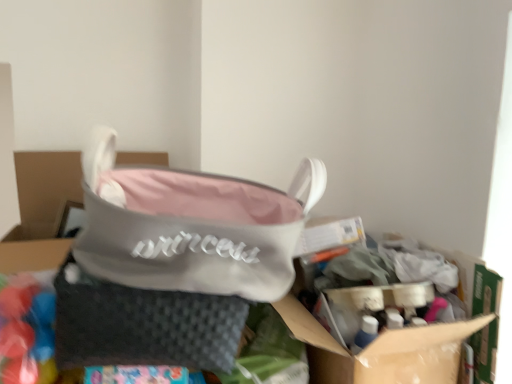
Question: Considering the relative sizes of cardboard box at center and pink fabric handbag at center in the image provided, is cardboard box at center thinner than pink fabric handbag at center?

Choices:
 (A) no
 (B) yes

Answer: (A)

Question: Does cardboard box at center have a smaller size compared to pink fabric handbag at center?

Choices:
 (A) yes
 (B) no

Answer: (B)

Question: From the image's perspective, is cardboard box at center over pink fabric handbag at center?

Choices:
 (A) no
 (B) yes

Answer: (A)

Question: Is cardboard box at center not close to pink fabric handbag at center?

Choices:
 (A) yes
 (B) no

Answer: (B)

Question: Is cardboard box at center facing away from pink fabric handbag at center?

Choices:
 (A) no
 (B) yes

Answer: (A)

Question: Considering the relative sizes of cardboard box at center and pink fabric handbag at center in the image provided, is cardboard box at center bigger than pink fabric handbag at center?

Choices:
 (A) no
 (B) yes

Answer: (B)

Question: Does cardboard box at center lie behind gray woven pouch at center?

Choices:
 (A) yes
 (B) no

Answer: (A)

Question: Are cardboard box at center and gray woven pouch at center located far from each other?

Choices:
 (A) yes
 (B) no

Answer: (B)

Question: Is cardboard box at center at the right side of gray woven pouch at center?

Choices:
 (A) no
 (B) yes

Answer: (B)

Question: From the image's perspective, would you say cardboard box at center is positioned over gray woven pouch at center?

Choices:
 (A) no
 (B) yes

Answer: (A)

Question: Is cardboard box at center positioned beyond the bounds of gray woven pouch at center?

Choices:
 (A) yes
 (B) no

Answer: (A)

Question: Can you confirm if cardboard box at center is positioned to the left of gray woven pouch at center?

Choices:
 (A) no
 (B) yes

Answer: (A)

Question: Is pink fabric handbag at center oriented towards cardboard box at center?

Choices:
 (A) yes
 (B) no

Answer: (B)